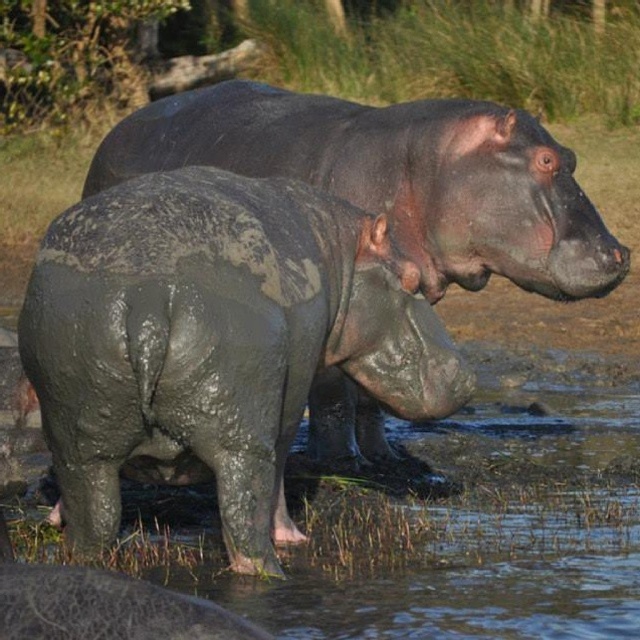
Which is above, muddy water at lower center or muddy gray hippo at center?

muddy gray hippo at center

Who is shorter, muddy water at lower center or muddy gray hippo at center?

With less height is muddy water at lower center.

Which is in front, point (592, 490) or point (168, 124)?

Positioned in front is point (592, 490).

Locate an element on the screen. This screenshot has width=640, height=640. muddy water at lower center is located at coordinates (448, 520).

Is point (179, 182) closer to viewer compared to point (51, 556)?

Yes.

At what (x,y) coordinates should I click in order to perform the action: click on muddy gray elephant at lower left. Please return your answer as a coordinate pair (x, y). Looking at the image, I should click on (216, 339).

Is point (316, 332) behind point (387, 456)?

That is False.

The width and height of the screenshot is (640, 640). What are the coordinates of `muddy gray elephant at lower left` in the screenshot? It's located at (216, 339).